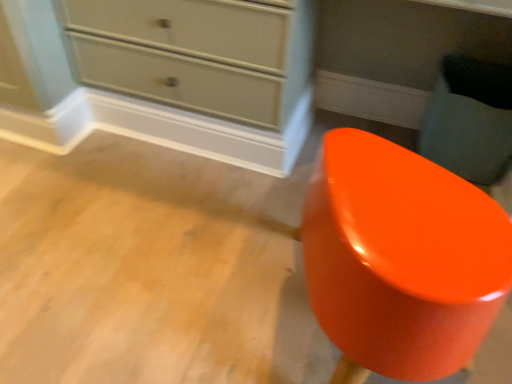
Question: Should I look upward or downward to see glossy orange stool at lower right?

Choices:
 (A) up
 (B) down

Answer: (A)

Question: Does glossy orange stool at lower right turn towards glossy orange stool at lower right?

Choices:
 (A) yes
 (B) no

Answer: (A)

Question: Is the position of glossy orange stool at lower right less distant than that of glossy orange stool at lower right?

Choices:
 (A) yes
 (B) no

Answer: (B)

Question: From the image's perspective, does glossy orange stool at lower right appear higher than glossy orange stool at lower right?

Choices:
 (A) yes
 (B) no

Answer: (A)

Question: Does glossy orange stool at lower right appear on the right side of glossy orange stool at lower right?

Choices:
 (A) yes
 (B) no

Answer: (A)

Question: Is glossy orange stool at lower right located within glossy orange stool at lower right?

Choices:
 (A) no
 (B) yes

Answer: (A)

Question: Is glossy orange stool at lower right facing away from glossy orange stool at lower right?

Choices:
 (A) no
 (B) yes

Answer: (A)

Question: Is glossy orange stool at lower right positioned behind glossy orange stool at lower right?

Choices:
 (A) no
 (B) yes

Answer: (A)

Question: Is glossy orange stool at lower right thinner than glossy orange stool at lower right?

Choices:
 (A) no
 (B) yes

Answer: (A)

Question: From the image's perspective, is glossy orange stool at lower right on top of glossy orange stool at lower right?

Choices:
 (A) no
 (B) yes

Answer: (A)

Question: Does glossy orange stool at lower right appear on the left side of glossy orange stool at lower right?

Choices:
 (A) no
 (B) yes

Answer: (B)

Question: Can we say glossy orange stool at lower right lies outside glossy orange stool at lower right?

Choices:
 (A) no
 (B) yes

Answer: (B)

Question: Is glossy orange stool at lower right turned away from glossy orange stool at lower right?

Choices:
 (A) yes
 (B) no

Answer: (B)

Question: Considering the relative positions of glossy orange stool at lower right and glossy orange stool at lower right in the image provided, is glossy orange stool at lower right to the left or to the right of glossy orange stool at lower right?

Choices:
 (A) right
 (B) left

Answer: (A)